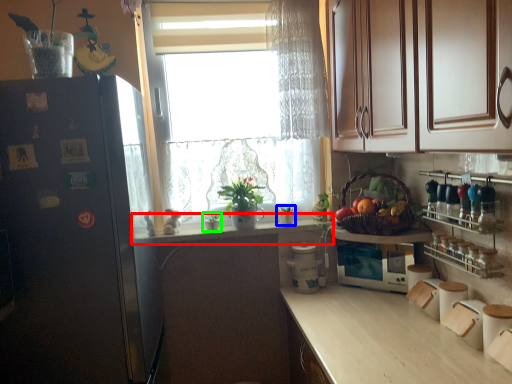
Question: Estimate the real-world distances between objects in this image. Which object is closer to countertop (highlighted by a red box), houseplant (highlighted by a blue box) or houseplant (highlighted by a green box)?

Choices:
 (A) houseplant
 (B) houseplant

Answer: (B)